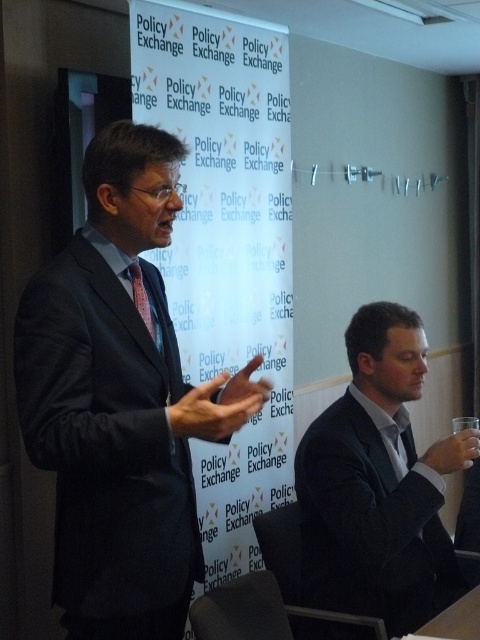
Question: Which object is closer to the camera taking this photo?

Choices:
 (A) dark gray suit at center
 (B) pink silk tie at center
 (C) dark gray suit at right

Answer: (A)

Question: Which object is farther from the camera taking this photo?

Choices:
 (A) dark gray suit at center
 (B) pink silk tie at center

Answer: (B)

Question: Which object is the closest to the pink silk tie at center?

Choices:
 (A) dark gray suit at right
 (B) dark gray suit at center

Answer: (B)

Question: Does dark gray suit at center have a greater width compared to pink silk tie at center?

Choices:
 (A) yes
 (B) no

Answer: (A)

Question: Observing the image, what is the correct spatial positioning of dark gray suit at right in reference to pink silk tie at center?

Choices:
 (A) below
 (B) above

Answer: (A)

Question: Observing the image, what is the correct spatial positioning of dark gray suit at center in reference to pink silk tie at center?

Choices:
 (A) above
 (B) below

Answer: (B)